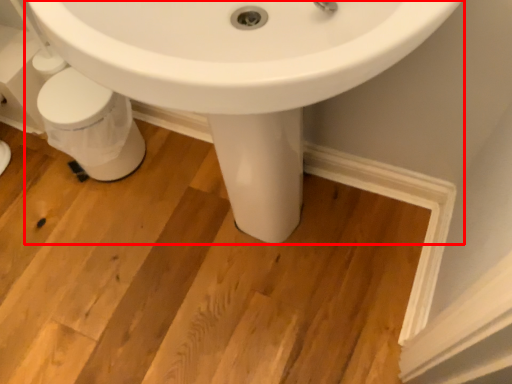
Question: From the image's perspective, where is sink (annotated by the red box) located in relation to porcelain in the image?

Choices:
 (A) above
 (B) below

Answer: (B)